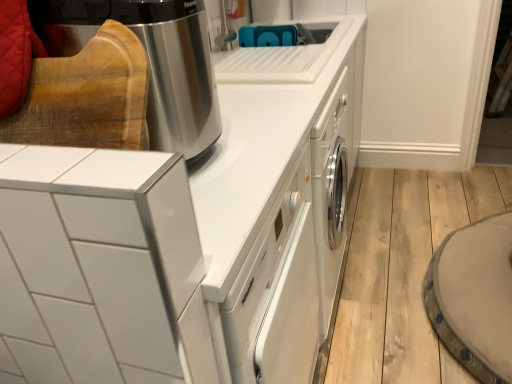
Where is `vacant area that is situated to the right of stainless steel coffee maker at upper left, the first home appliance positioned from the top`? This screenshot has height=384, width=512. vacant area that is situated to the right of stainless steel coffee maker at upper left, the first home appliance positioned from the top is located at coordinates (257, 139).